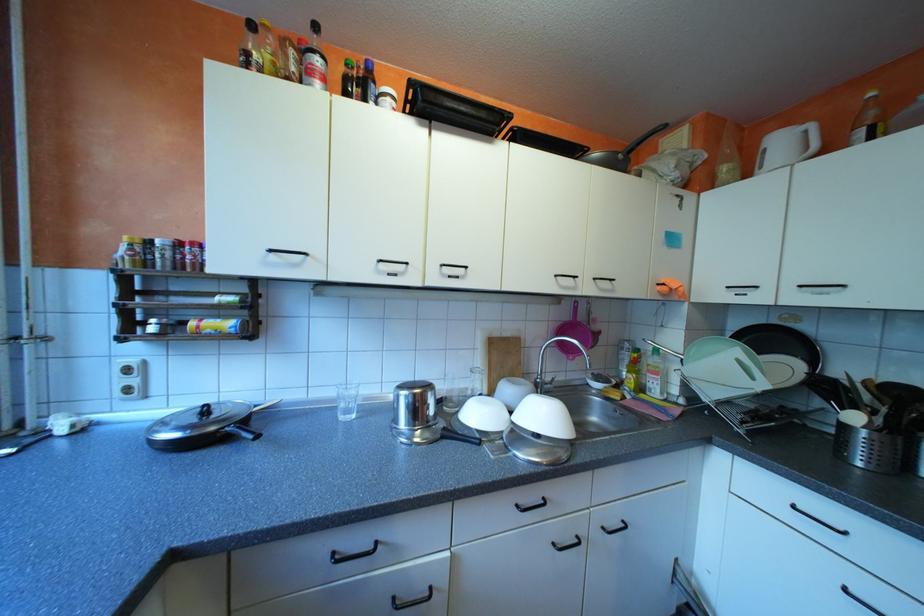
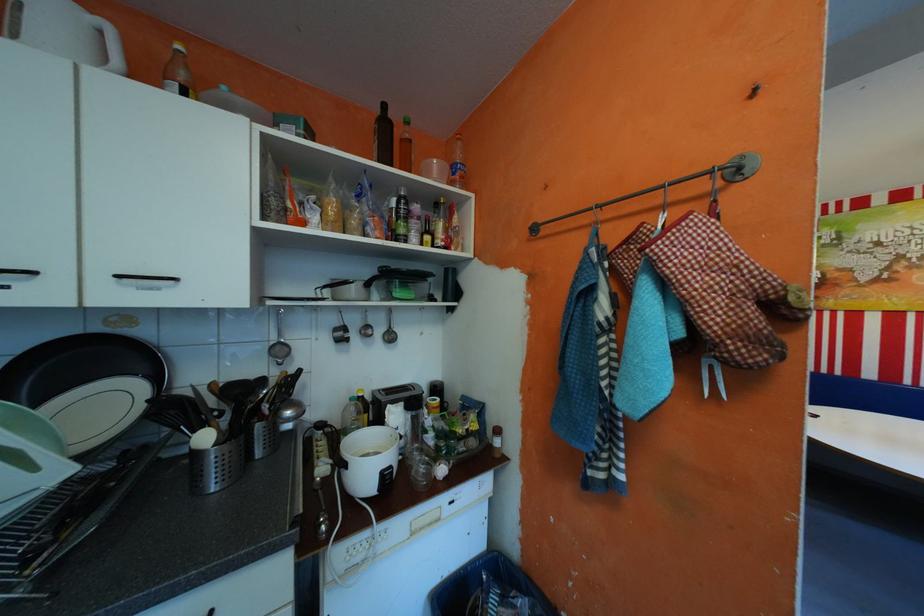
Question: The camera is either moving clockwise (left) or counter-clockwise (right) around the object. The first image is from the beginning of the video and the second image is from the end. Is the camera moving left or right when shooting the video?

Choices:
 (A) Left
 (B) Right

Answer: (A)